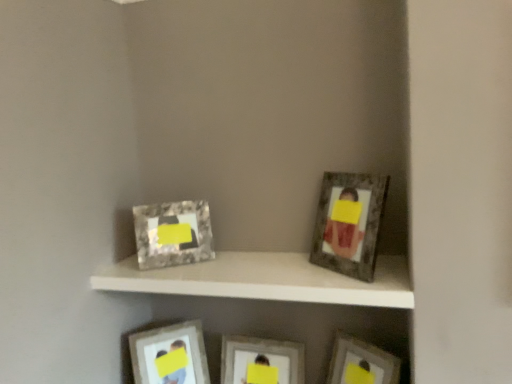
Question: Looking at their shapes, would you say matte silver picture frame at lower center, the first picture frame when ordered from left to right, is wider or thinner than matte silver picture frame at upper right, which is the second picture frame from right to left?

Choices:
 (A) thin
 (B) wide

Answer: (A)

Question: In terms of height, does matte silver picture frame at lower center, acting as the fifth picture frame starting from the right, look taller or shorter compared to matte silver picture frame at upper right, which is the second picture frame from right to left?

Choices:
 (A) tall
 (B) short

Answer: (A)

Question: Which object is the closest to the metallic silver picture frame at lower right, which ranks as the 1th picture frame in right-to-left order?

Choices:
 (A) matte silver picture frame at center, arranged as the third picture frame when viewed from the left
 (B) white matte shelf at center
 (C) matte silver picture frame at upper right, which is the second picture frame from right to left
 (D) matte silver picture frame at lower center, the first picture frame when ordered from left to right
 (E) marble-like frame at upper left, positioned as the 2th picture frame in left-to-right order

Answer: (A)

Question: Estimate the real-world distances between objects in this image. Which object is farther from the marble-like frame at upper left, positioned as the 2th picture frame in left-to-right order?

Choices:
 (A) matte silver picture frame at upper right, which is the second picture frame from right to left
 (B) metallic silver picture frame at lower right, which ranks as the 1th picture frame in right-to-left order
 (C) white matte shelf at center
 (D) matte silver picture frame at lower center, the first picture frame when ordered from left to right
 (E) matte silver picture frame at center, arranged as the third picture frame when viewed from the left

Answer: (B)